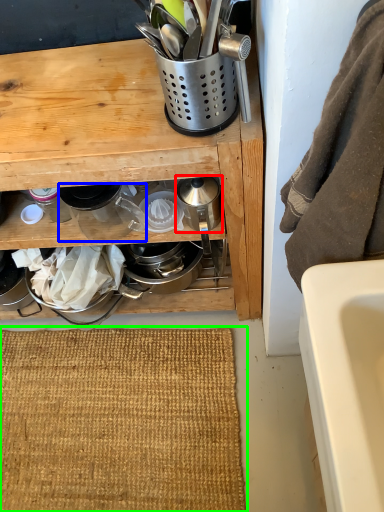
Question: Which is farther away from appliance (highlighted by a red box)? appliance (highlighted by a blue box) or doormat (highlighted by a green box)?

Choices:
 (A) appliance
 (B) doormat

Answer: (B)